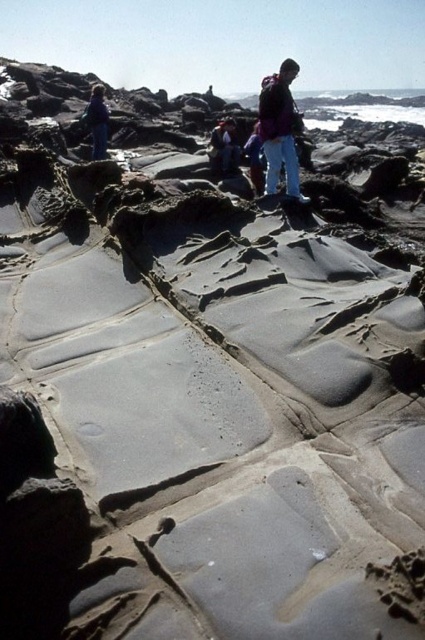
Which is above, purple fleece jacket at upper center or blue denim jacket at left?

blue denim jacket at left is higher up.

Describe the element at coordinates (280, 129) in the screenshot. I see `purple fleece jacket at upper center` at that location.

Find the location of a particular element. The image size is (425, 640). purple fleece jacket at upper center is located at coordinates (280, 129).

Who is positioned more to the right, blue denim jacket at left or blue jeans at center?

Positioned to the right is blue jeans at center.

Between blue denim jacket at left and blue jeans at center, which one is positioned lower?

blue jeans at center is below.

Between point (93, 90) and point (252, 173), which one is positioned in front?

Point (252, 173)

Locate an element on the screen. The image size is (425, 640). blue denim jacket at left is located at coordinates (96, 122).

Does purple fleece jacket at upper center have a greater width compared to blue jeans at center?

Yes.

Is purple fleece jacket at upper center to the left of blue jeans at center from the viewer's perspective?

Incorrect, purple fleece jacket at upper center is not on the left side of blue jeans at center.

Is point (272, 113) farther from viewer compared to point (248, 141)?

No, (272, 113) is closer to viewer.

Where is `purple fleece jacket at upper center`? The height and width of the screenshot is (640, 425). purple fleece jacket at upper center is located at coordinates (280, 129).